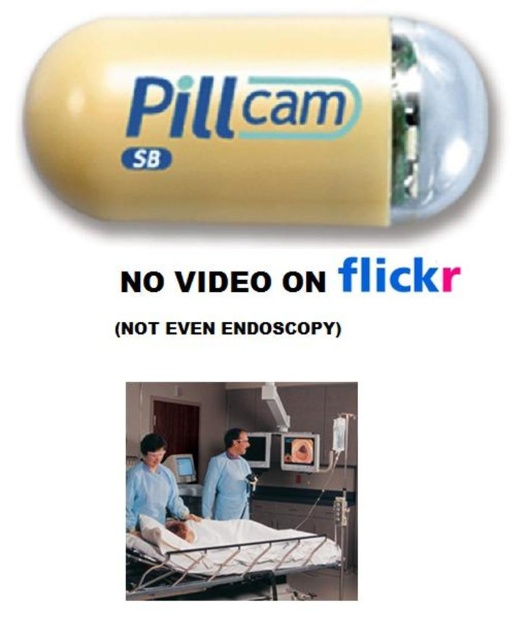
Question: Which object is closer to the camera taking this photo?

Choices:
 (A) blue fabric doctor at center
 (B) white mesh hospital bed at center
 (C) matte blue uniform at center

Answer: (B)

Question: In this image, where is white mesh hospital bed at center located relative to blue fabric doctor at center?

Choices:
 (A) right
 (B) left

Answer: (A)

Question: Does white mesh hospital bed at center have a lesser width compared to matte blue uniform at center?

Choices:
 (A) no
 (B) yes

Answer: (A)

Question: Which of the following is the closest to the observer?

Choices:
 (A) blue fabric doctor at center
 (B) white mesh hospital bed at center

Answer: (B)

Question: Can you confirm if white mesh hospital bed at center is bigger than matte blue uniform at center?

Choices:
 (A) no
 (B) yes

Answer: (B)

Question: Among these objects, which one is nearest to the camera?

Choices:
 (A) matte blue uniform at center
 (B) blue fabric doctor at center

Answer: (B)